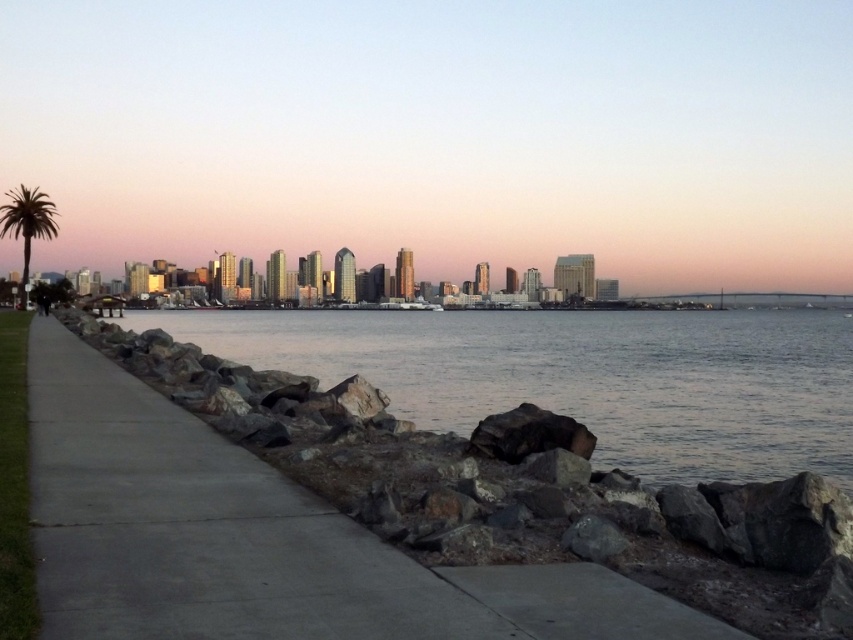
Can you confirm if clear water at lower left is thinner than black rock at center?

In fact, clear water at lower left might be wider than black rock at center.

Identify the location of clear water at lower left. The height and width of the screenshot is (640, 853). (582, 376).

Is point (193, 342) in front of point (500, 435)?

No, (193, 342) is further to viewer.

In order to click on clear water at lower left in this screenshot , I will do `click(582, 376)`.

Does black rock at center appear on the right side of green leafy palm tree at left?

Indeed, black rock at center is positioned on the right side of green leafy palm tree at left.

Between black rock at center and green leafy palm tree at left, which one has more height?

green leafy palm tree at left is taller.

Identify the location of black rock at center. Image resolution: width=853 pixels, height=640 pixels. (529, 435).

Is clear water at lower left positioned behind green leafy palm tree at left?

No, it is not.

You are a GUI agent. You are given a task and a screenshot of the screen. Output one action in this format:
    pyautogui.click(x=<x>, y=<y>)
    Task: Click on the clear water at lower left
    This screenshot has height=640, width=853.
    Given the screenshot: What is the action you would take?
    pyautogui.click(x=582, y=376)

At what (x,y) coordinates should I click in order to perform the action: click on clear water at lower left. Please return your answer as a coordinate pair (x, y). Image resolution: width=853 pixels, height=640 pixels. Looking at the image, I should click on [x=582, y=376].